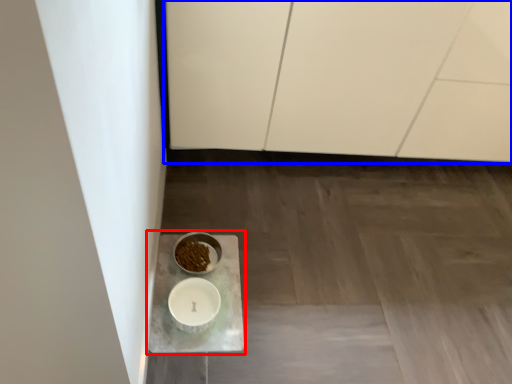
Question: Among these objects, which one is nearest to the camera, table (highlighted by a red box) or cabinetry (highlighted by a blue box)?

Choices:
 (A) table
 (B) cabinetry

Answer: (B)